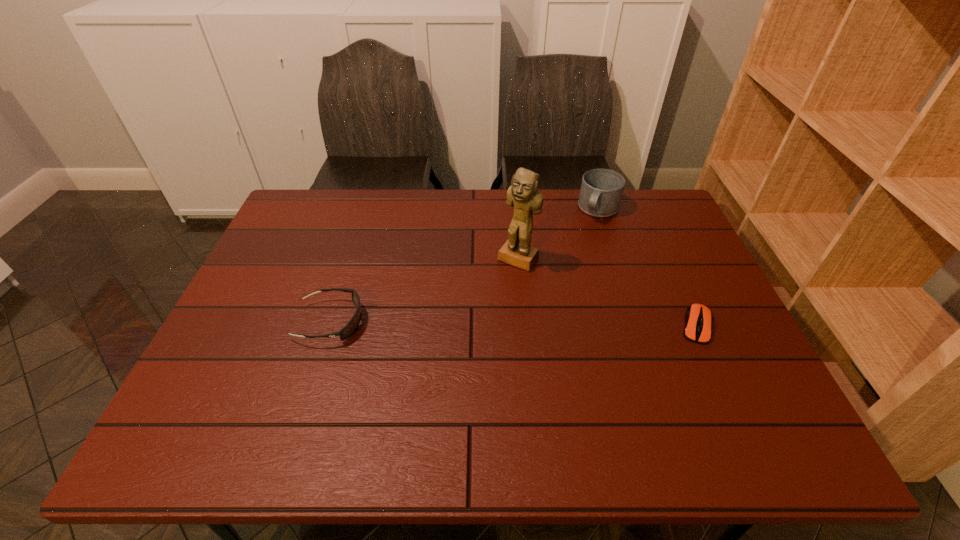
Locate an element on the screen. The height and width of the screenshot is (540, 960). vacant region located 0.160m on the side of the second tallest object with the handle is located at coordinates (579, 253).

Identify the location of vacant space situated on the side of the second tallest object with the handle. (583, 246).

The height and width of the screenshot is (540, 960). What are the coordinates of `blank area located on the side of the second tallest object with the handle` in the screenshot? It's located at (567, 274).

Where is `free point located on the front-facing side of the second object from left to right`? free point located on the front-facing side of the second object from left to right is located at coordinates (456, 350).

Identify the location of vacant space located 0.360m on the front-facing side of the second object from left to right. This screenshot has height=540, width=960. (445, 366).

Locate an element on the screen. The height and width of the screenshot is (540, 960). free location located on the front-facing side of the second object from left to right is located at coordinates (482, 311).

You are a GUI agent. You are given a task and a screenshot of the screen. Output one action in this format:
    pyautogui.click(x=<x>, y=<y>)
    Task: Click on the object located in the far edge section of the desktop
    
    Given the screenshot: What is the action you would take?
    pyautogui.click(x=601, y=191)

The width and height of the screenshot is (960, 540). I want to click on object present at the right edge, so click(698, 318).

At what (x,y) coordinates should I click in order to perform the action: click on vacant space at the far edge. Please return your answer as a coordinate pair (x, y). Looking at the image, I should click on (511, 213).

In the image, there is a desktop. At what (x,y) coordinates should I click in order to perform the action: click on free space at the near edge. Please return your answer as a coordinate pair (x, y). The height and width of the screenshot is (540, 960). Looking at the image, I should click on (372, 406).